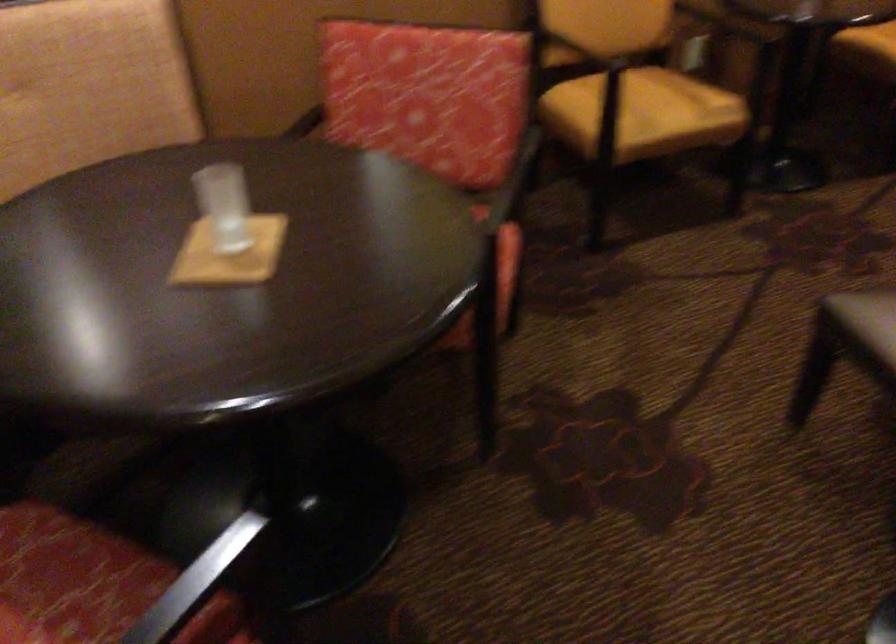
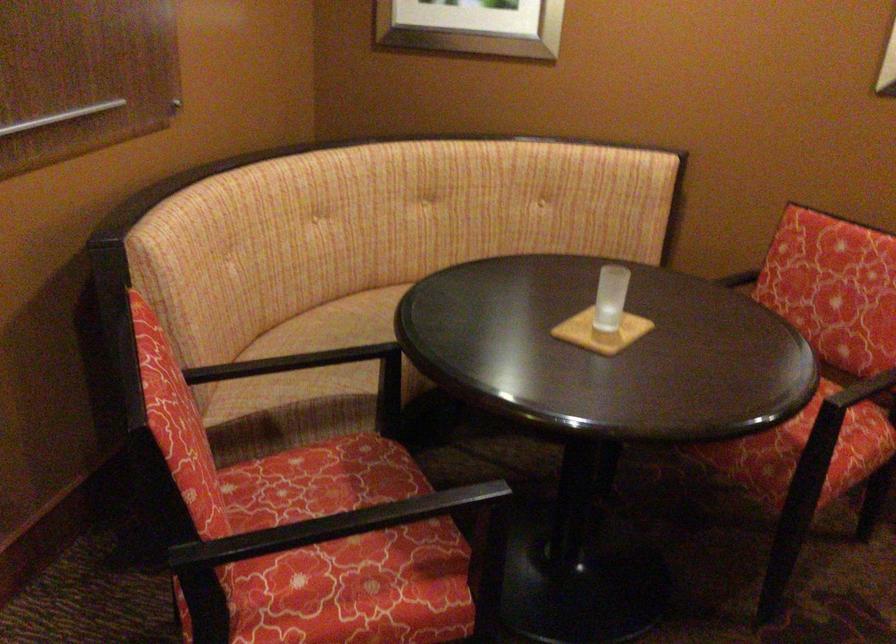
Where in the second image is the point corresponding to (233,204) from the first image?

(609, 297)